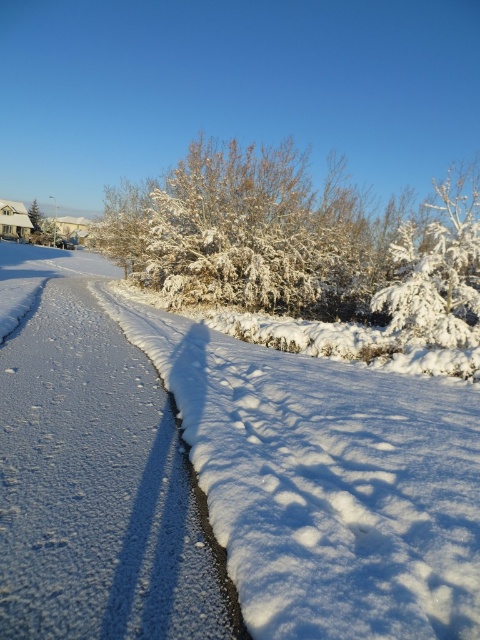
You are standing at the point marked as point (93, 474) in the image. Looking around, you see white snow at center. What is directly beneath your feet?

The point (93, 474) is where the white snow at center is located, so the white snow at center is directly beneath your feet.

You are standing at the starting point of the snow road and want to reach a destination marked by two points. The first point is point (84, 634) and the second point is point (211, 157). Which point should you head towards first if you want to reach the destination in the shortest path possible?

You should head towards point (84, 634) first because it is closer to your starting position than point (211, 157), allowing you to reach the destination in the shortest path possible.